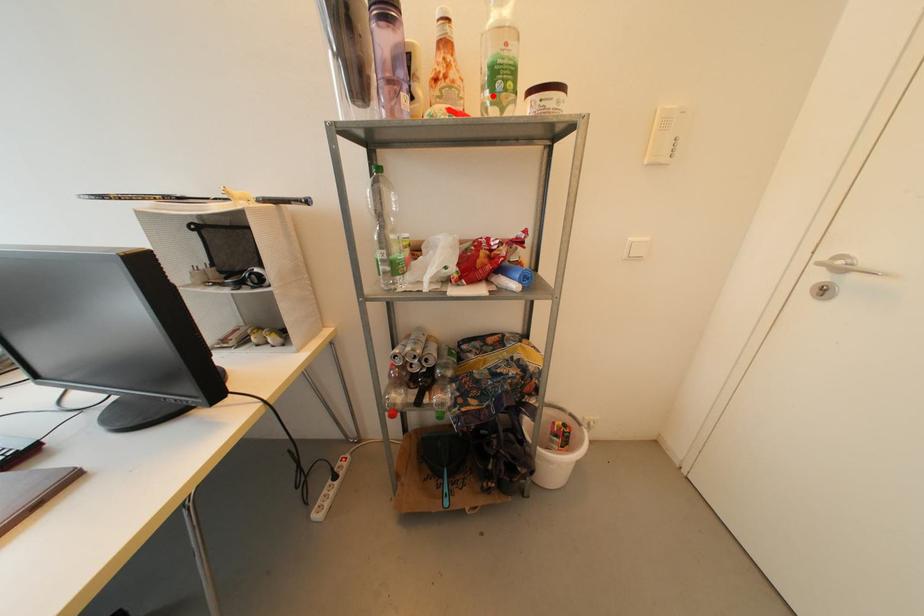
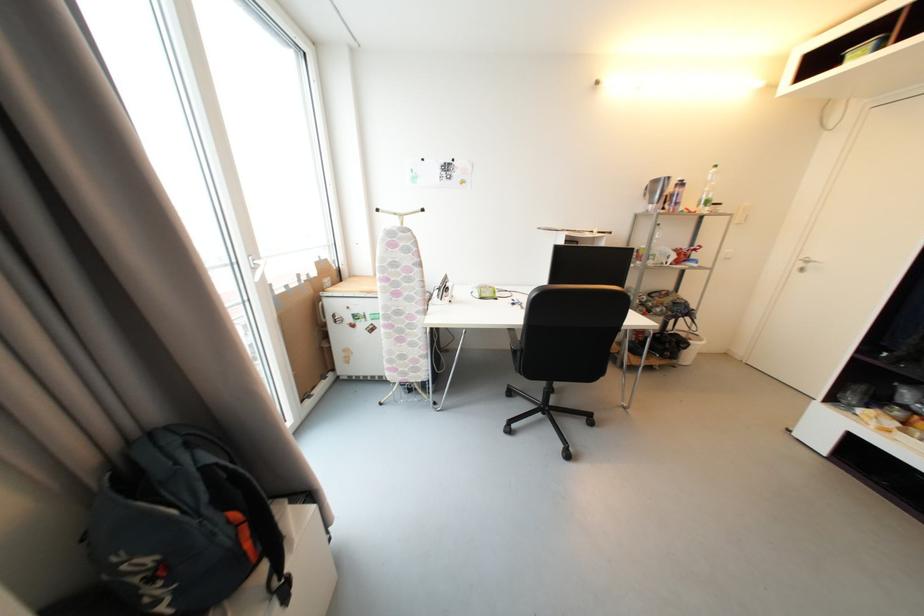
Locate, in the second image, the point that corresponds to the highlighted location in the first image.

(707, 208)